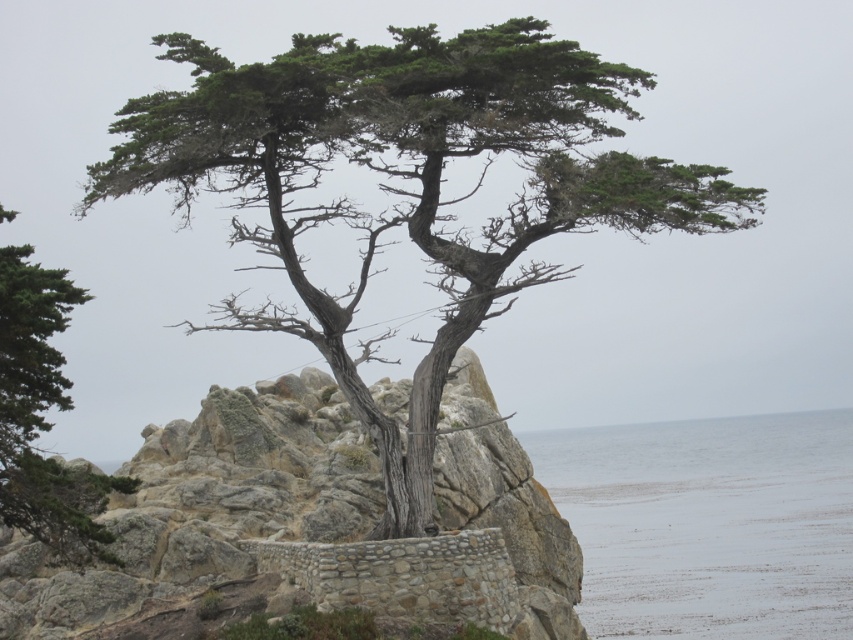
You are a hiker standing at the edge of the rocky outcrop and see the green textured tree at center and the green textured tree at left. Which tree is positioned closer to your left side?

The green textured tree at left is positioned closer to your left side since it is located to the left of the green textured tree at center.